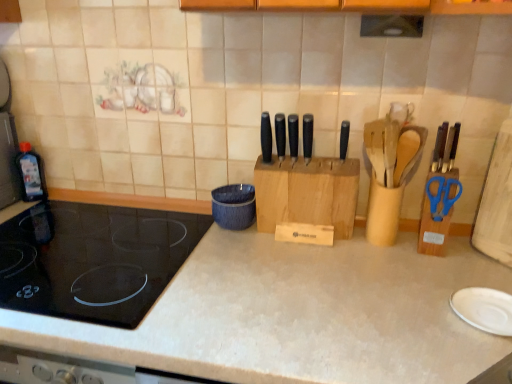
This screenshot has height=384, width=512. Find the location of `free point behind black matte knife at center, which is the third knife from right to left`. free point behind black matte knife at center, which is the third knife from right to left is located at coordinates (303, 156).